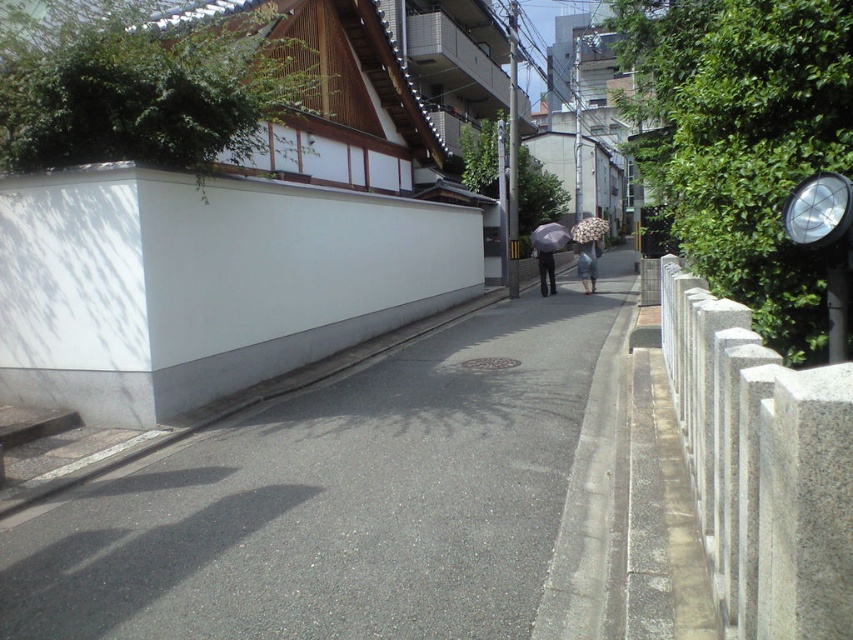
Is gray asphalt pavement at center closer to the viewer compared to dark gray pants at center?

Yes, it is in front of dark gray pants at center.

Is gray asphalt pavement at center further to the viewer compared to dark gray pants at center?

No.

Between point (410, 634) and point (546, 292), which one is positioned in front?

Point (410, 634)

I want to click on gray asphalt pavement at center, so click(x=338, y=499).

Does transparent fabric umbrella at center appear under dark gray pants at center?

Incorrect, transparent fabric umbrella at center is not positioned below dark gray pants at center.

Who is positioned more to the left, transparent fabric umbrella at center or dark gray pants at center?

From the viewer's perspective, dark gray pants at center appears more on the left side.

At what (x,y) coordinates should I click in order to perform the action: click on transparent fabric umbrella at center. Please return your answer as a coordinate pair (x, y). Looking at the image, I should click on (549, 237).

The image size is (853, 640). In order to click on gray asphalt pavement at center in this screenshot , I will do `click(338, 499)`.

Does gray asphalt pavement at center have a greater width compared to transparent plastic umbrella at center?

No, gray asphalt pavement at center is not wider than transparent plastic umbrella at center.

Is point (473, 424) closer to viewer compared to point (584, 228)?

Yes, point (473, 424) is closer to viewer.

Where is `gray asphalt pavement at center`? This screenshot has width=853, height=640. gray asphalt pavement at center is located at coordinates (338, 499).